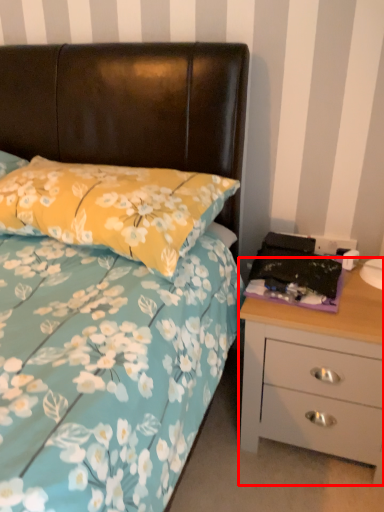
Question: Observing the image, what is the correct spatial positioning of chest of drawers (annotated by the red box) in reference to pillow?

Choices:
 (A) right
 (B) left

Answer: (A)